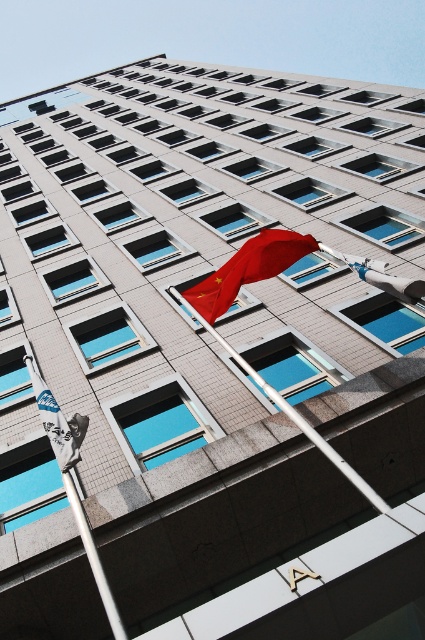
You are a photographer planning to take a photo of the building while standing at the front entrance. You want to include both the silver metallic flag pole at left and the white metallic flag pole at center in your shot. Which flagpole will appear taller in the photo?

The silver metallic flag pole at left is bigger than the white metallic flag pole at center, so it will appear taller in the photo.

You are a photographer standing in front of the building. You want to take a picture that includes both the silver metallic flag pole at left and the blue fabric flag at lower left. Which object should you position closer to the center of your frame to ensure both are fully visible?

The silver metallic flag pole at left might be wider than blue fabric flag at lower left, so you should position the silver metallic flag pole at left closer to the center of your frame to ensure both are fully visible.